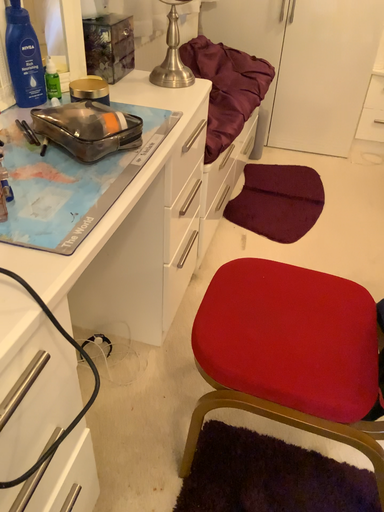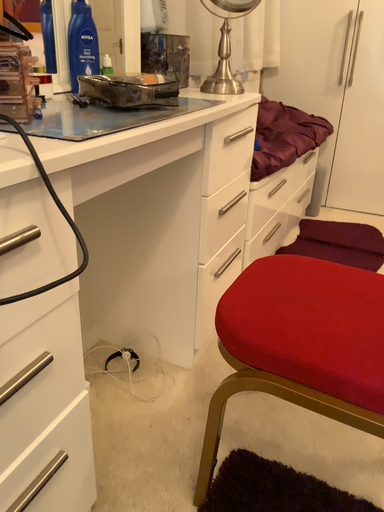
Question: Which way did the camera rotate in the video?

Choices:
 (A) rotated downward
 (B) rotated upward

Answer: (B)